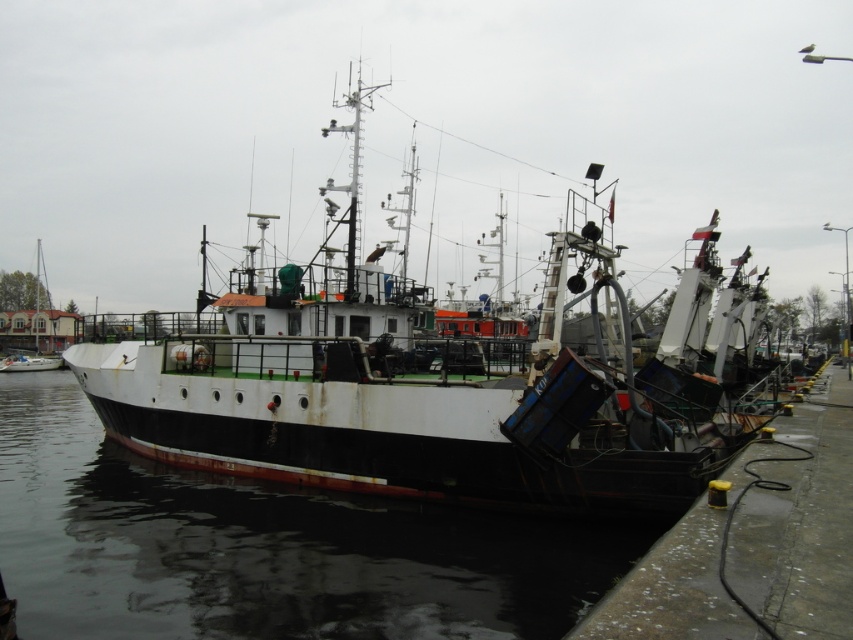
Question: Considering the real-world distances, which object is farthest from the white matte boat at left?

Choices:
 (A) black matte water at lower left
 (B) rusty metal boat at center

Answer: (A)

Question: Which object is farther from the camera taking this photo?

Choices:
 (A) rusty metal boat at center
 (B) white matte boat at left
 (C) black matte water at lower left

Answer: (B)

Question: Can you confirm if rusty metal boat at center is positioned to the left of white matte boat at left?

Choices:
 (A) yes
 (B) no

Answer: (B)

Question: Is rusty metal boat at center behind black matte water at lower left?

Choices:
 (A) no
 (B) yes

Answer: (B)

Question: Which point appears closest to the camera in this image?

Choices:
 (A) [x=165, y=593]
 (B) [x=534, y=371]
 (C) [x=21, y=273]

Answer: (A)

Question: Is the position of rusty metal boat at center more distant than that of black matte water at lower left?

Choices:
 (A) yes
 (B) no

Answer: (A)